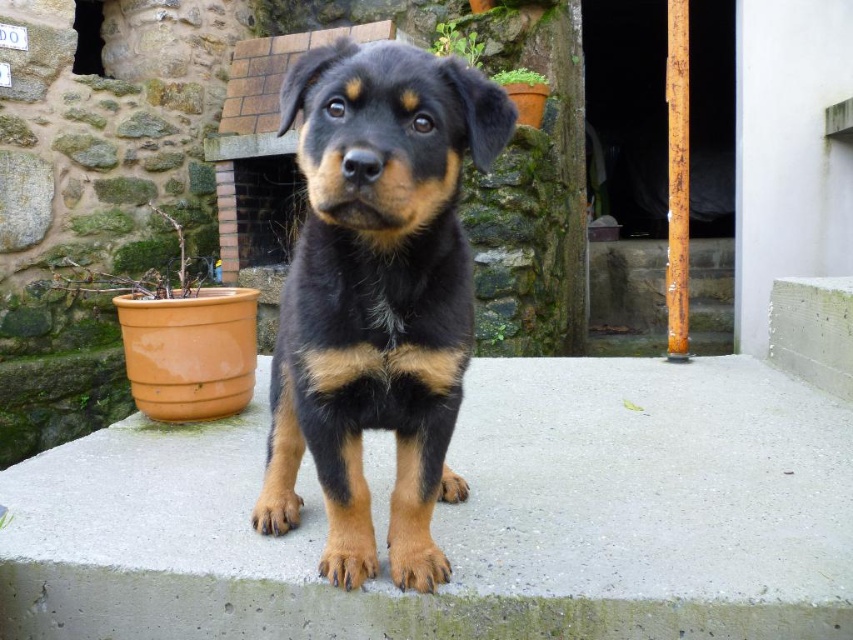
Who is more distant from viewer, (447, 344) or (648, 314)?

Positioned behind is point (648, 314).

Does black fur puppy at center have a greater height compared to smooth concrete stairs at center?

No.

Who is more distant from viewer, (490, 125) or (715, 241)?

Positioned behind is point (715, 241).

You are a GUI agent. You are given a task and a screenshot of the screen. Output one action in this format:
    pyautogui.click(x=<x>, y=<y>)
    Task: Click on the black fur puppy at center
    Image resolution: width=853 pixels, height=640 pixels.
    Given the screenshot: What is the action you would take?
    pyautogui.click(x=376, y=296)

Between smooth concrete at center and smooth concrete stairs at center, which one is positioned lower?

smooth concrete at center is below.

Who is positioned more to the right, smooth concrete at center or smooth concrete stairs at center?

Positioned to the right is smooth concrete stairs at center.

This screenshot has height=640, width=853. Describe the element at coordinates (466, 518) in the screenshot. I see `smooth concrete at center` at that location.

At what (x,y) coordinates should I click in order to perform the action: click on smooth concrete at center. Please return your answer as a coordinate pair (x, y). This screenshot has width=853, height=640. Looking at the image, I should click on (466, 518).

How much distance is there between smooth concrete at center and black fur puppy at center?

smooth concrete at center and black fur puppy at center are 19.44 inches apart.

Does point (39, 548) lie behind point (372, 148)?

That is True.

Which is in front, point (189, 440) or point (326, 499)?

Positioned in front is point (326, 499).

Find the location of a particular element. The width and height of the screenshot is (853, 640). smooth concrete at center is located at coordinates (466, 518).